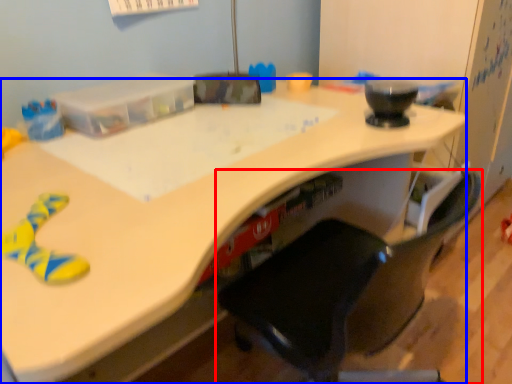
Question: Which object appears closest to the camera in this image, chair (highlighted by a red box) or desk (highlighted by a blue box)?

Choices:
 (A) chair
 (B) desk

Answer: (A)